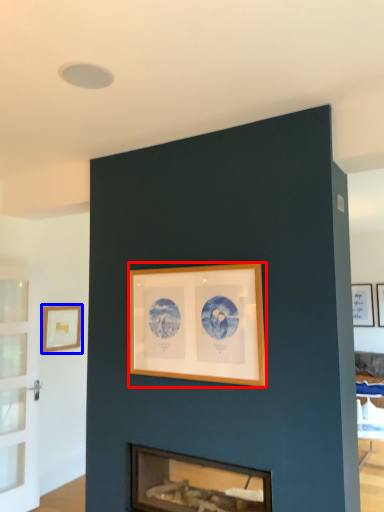
Question: Which object is further to the camera taking this photo, picture frame (highlighted by a red box) or picture frame (highlighted by a blue box)?

Choices:
 (A) picture frame
 (B) picture frame

Answer: (B)